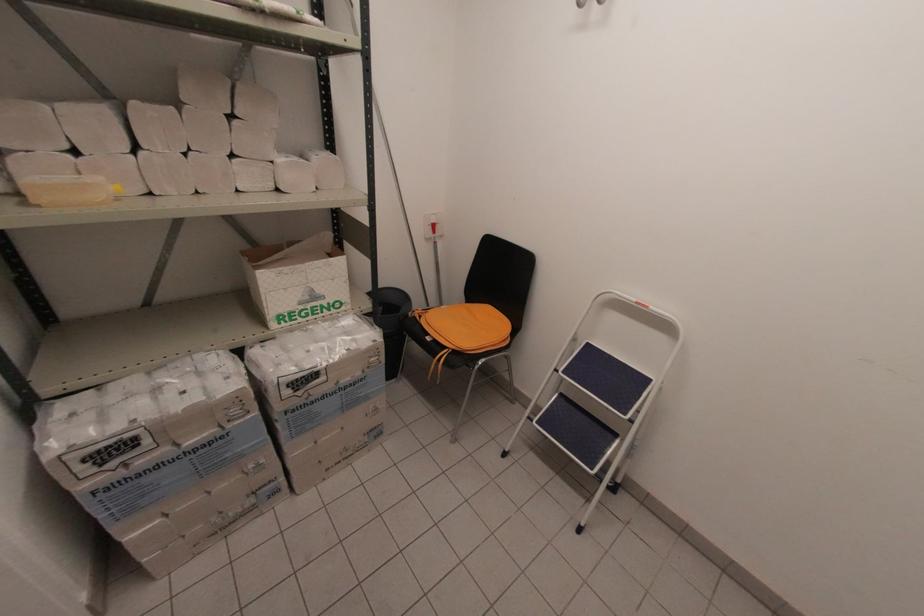
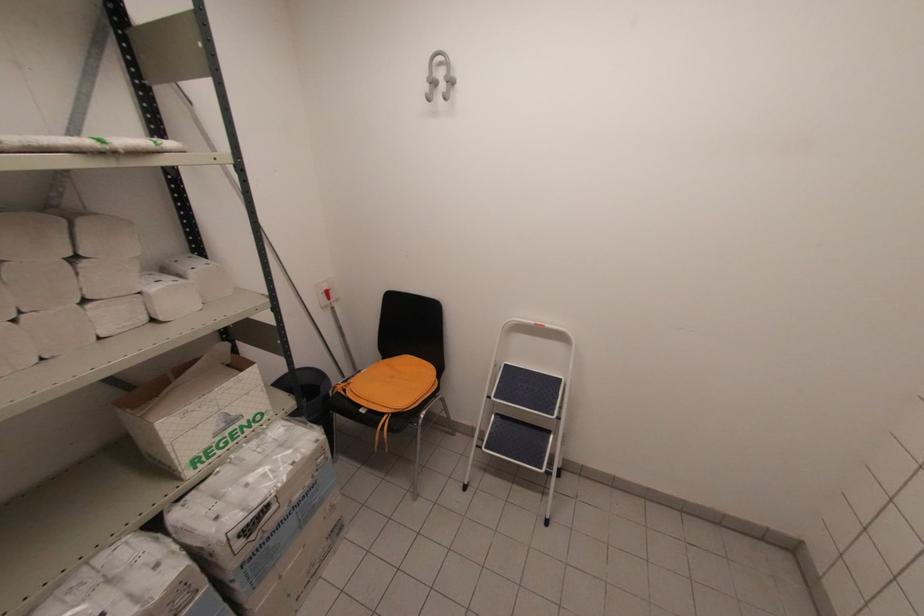
Locate, in the second image, the point that corresponds to the point at 309,298 in the first image.

(224, 426)